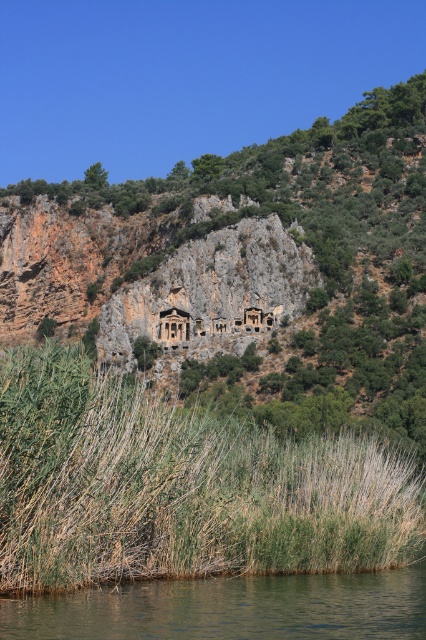
Between green grassy reed at lower center and brown/rough water at lower center, which one is positioned lower?

brown/rough water at lower center is below.

Is green grassy reed at lower center positioned before brown/rough water at lower center?

No.

Identify the location of green grassy reed at lower center. (181, 486).

The image size is (426, 640). Find the location of `green grassy reed at lower center`. green grassy reed at lower center is located at coordinates (181, 486).

Does green grass at center lie behind brown/rough water at lower center?

Yes, it is behind brown/rough water at lower center.

Who is more forward, (192, 180) or (201, 600)?

Point (201, 600) is in front.

Which is behind, point (351, 273) or point (270, 586)?

Positioned behind is point (351, 273).

Identify the location of green grass at center. The height and width of the screenshot is (640, 426). (247, 273).

Between green grass at center and matte stone tomb at center, which one appears on the left side from the viewer's perspective?

matte stone tomb at center is more to the left.

Looking at this image, which of these two, green grass at center or matte stone tomb at center, stands taller?

green grass at center

Which is behind, point (253, 195) or point (183, 323)?

Point (253, 195)

Locate an element on the screen. green grass at center is located at coordinates (247, 273).